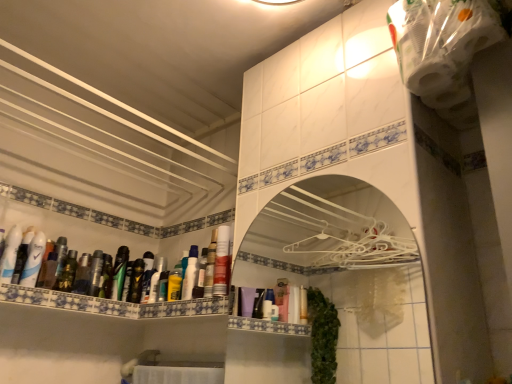
Question: Considering the positions of white glossy mouthwash at left, placed as the 12th mouthwash when sorted from right to left, and white glossy mouthwash at upper center, acting as the 12th mouthwash starting from the left, in the image, is white glossy mouthwash at left, placed as the 12th mouthwash when sorted from right to left, wider or thinner than white glossy mouthwash at upper center, acting as the 12th mouthwash starting from the left,?

Choices:
 (A) wide
 (B) thin

Answer: (A)

Question: Based on their positions, is white glossy mouthwash at left, placed as the 12th mouthwash when sorted from right to left, located to the left or right of white glossy mouthwash at upper center, acting as the 12th mouthwash starting from the left?

Choices:
 (A) left
 (B) right

Answer: (A)

Question: Estimate the real-world distances between objects in this image. Which object is farther from the white glossy mouthwash at left, the 1th mouthwash positioned from the left?

Choices:
 (A) matte black tube at left, positioned as the 3th toiletry in right-to-left order
 (B) metallic silver mouthwash at left, which is the sixth mouthwash in right-to-left order
 (C) white glossy bottle at upper left, the 4th mouthwash in the right-to-left sequence
 (D) matte plastic bottles at left
 (E) green matte toothpaste at left, marked as the seventh mouthwash in a right-to-left arrangement

Answer: (C)

Question: Estimate the real-world distances between objects in this image. Which object is farther from the shiny metallic spray can at left, which ranks as the second toiletry in right-to-left order?

Choices:
 (A) metallic silver mouthwash at left, acting as the seventh mouthwash starting from the left
 (B) white glossy bottle at upper left, the 4th mouthwash in the right-to-left sequence
 (C) green matte mouthwash at left, which ranks as the 10th mouthwash in right-to-left order
 (D) green matte toothpaste at left, marked as the seventh mouthwash in a right-to-left arrangement
 (E) metallic silver mouthwash at left, the fourth mouthwash from the left

Answer: (B)